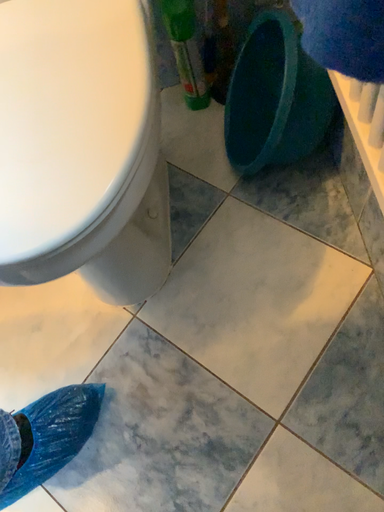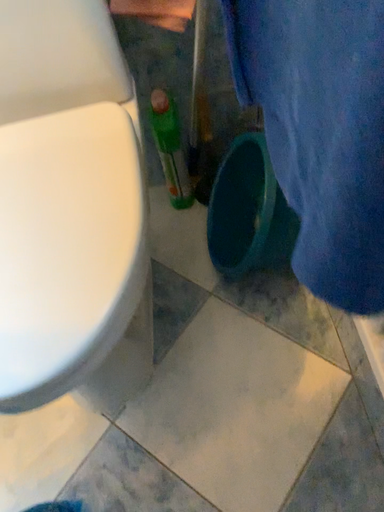
Question: Which way did the camera rotate in the video?

Choices:
 (A) rotated upward
 (B) rotated downward

Answer: (A)